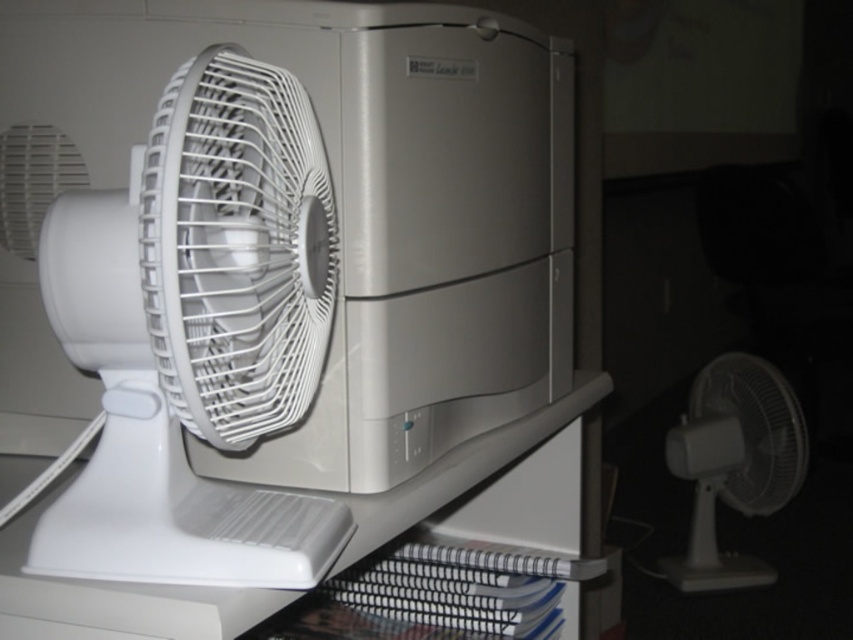
Question: Does white plastic fan at left lie in front of white plastic fan at lower right?

Choices:
 (A) no
 (B) yes

Answer: (B)

Question: Which point is closer to the camera?

Choices:
 (A) white plastic fan at lower right
 (B) white plastic fan at left

Answer: (B)

Question: Is white plastic fan at left thinner than white plastic fan at lower right?

Choices:
 (A) yes
 (B) no

Answer: (A)

Question: Is white plastic fan at left smaller than white plastic fan at lower right?

Choices:
 (A) no
 (B) yes

Answer: (B)

Question: Which point appears closest to the camera in this image?

Choices:
 (A) (265, 426)
 (B) (682, 456)

Answer: (A)